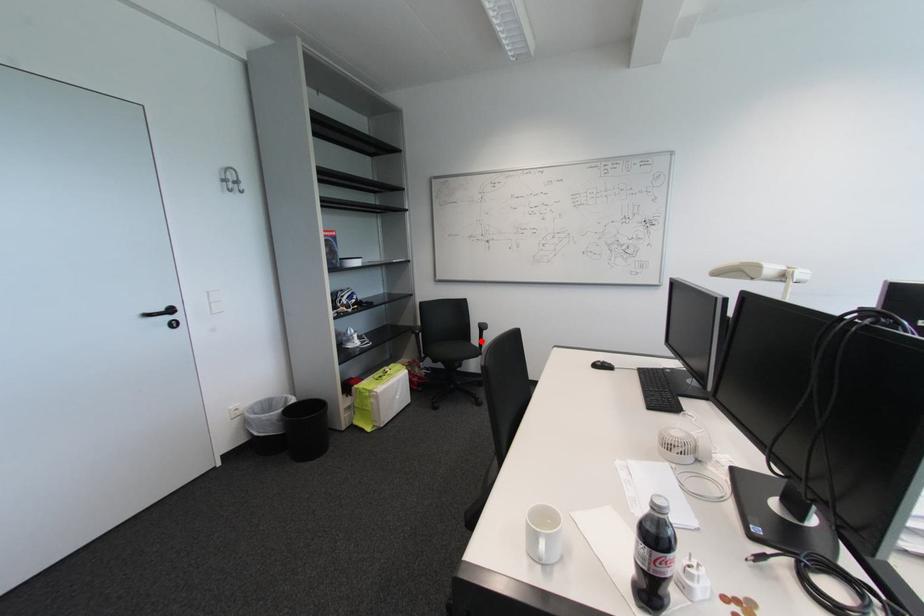
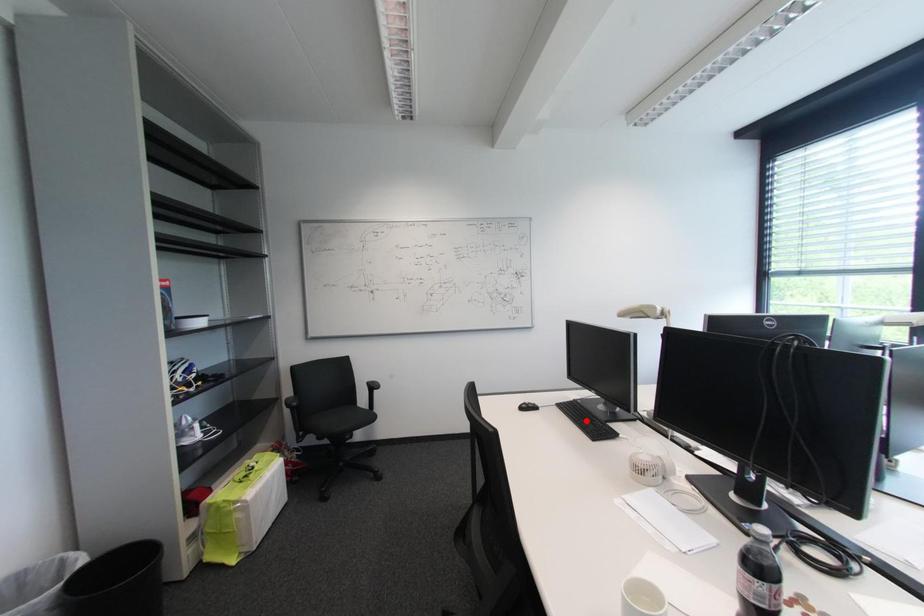
I am providing you with two images of the same scene from different viewpoints. A red point is marked on the first image and another point is marked on the second image. Are the points marked in image1 and image2 representing the same 3D position?

No